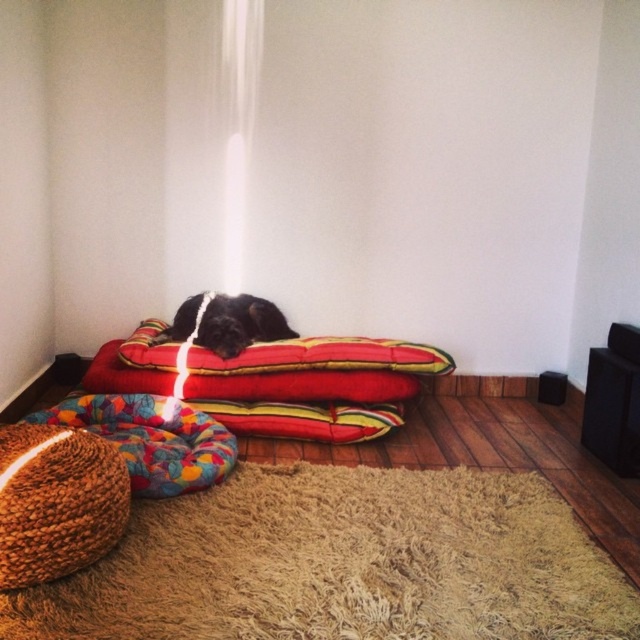
You are a pet sitter who needs to move the brown knitted bean bag chair at lower left. However, you must ensure that the black fur dog at center doesn not get disturbed. Can you move the chair without moving the dog?

The brown knitted bean bag chair at lower left is positioned under the black fur dog at center, so you cannot move the chair without moving the dog because the dog is on top of it.

You are standing in the room and want to place a small plant pot that is 1.5 meters tall. The plant pot needs to be placed exactly at the point marked as point (36, 563). Considering the distance between you and the point, will the plant pot be visible to someone standing where you are?

The point (36, 563) is 1.78 meters away from the viewer. Since the plant pot is 1.5 meters tall, and assuming it is placed upright, the top of the plant pot would be 1.5 meters high. If the viewer is standing at a typical eye level of around 1.6 to 1.7 meters, they would be able to see the top of the plant pot but might have a partial view depending on any obstructions. However, since the scene description mentions no obstacles between the viewer and the point, the plant pot would be mostly visible.

You are standing in the room and want to place a new toy that is 2 feet long on the floor. The multicolored fabric dog bed at lower left is currently occupying space. Is there enough space between you and the bed to place the toy without moving the bed?

The multicolored fabric dog bed at lower left is 7.41 feet from the viewer. Since the toy is only 2 feet long, there is sufficient space between you and the bed to place the toy without needing to move the bed.